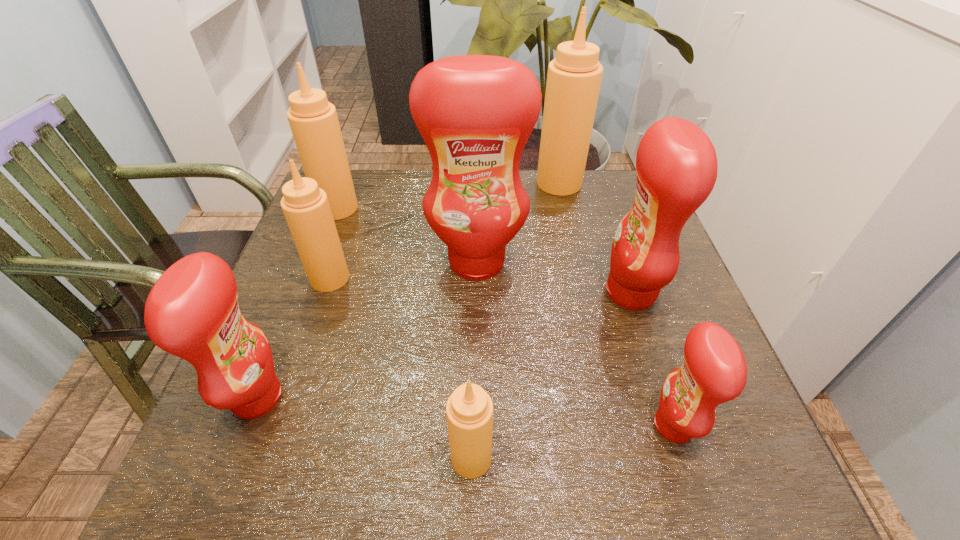
At what (x,y) coordinates should I click in order to perform the action: click on object that stands as the sixth closest to the second smallest red condiment. Please return your answer as a coordinate pair (x, y). The width and height of the screenshot is (960, 540). Looking at the image, I should click on (714, 371).

At what (x,y) coordinates should I click in order to perform the action: click on the fourth closest object to the third tan condiment from left to right. Please return your answer as a coordinate pair (x, y). This screenshot has height=540, width=960. Looking at the image, I should click on (475, 113).

Point out which condiment is positioned as the nearest to the smallest tan condiment. Please provide its 2D coordinates. Your answer should be formatted as a tuple, i.e. [(x, y)], where the tuple contains the x and y coordinates of a point satisfying the conditions above.

[(714, 371)]

I want to click on condiment that can be found as the fourth closest to the third biggest tan condiment, so click(469, 410).

Where is `the fourth closest tan condiment relative to the third smallest red condiment`? the fourth closest tan condiment relative to the third smallest red condiment is located at coordinates (313, 120).

Image resolution: width=960 pixels, height=540 pixels. What are the coordinates of `the third closest tan condiment relative to the third red condiment from right to left` in the screenshot? It's located at pyautogui.click(x=313, y=120).

What are the coordinates of `red condiment that is the third closest to the smallest red condiment` in the screenshot? It's located at (192, 312).

Point out which red condiment is positioned as the nearest to the third farthest tan condiment. Please provide its 2D coordinates. Your answer should be formatted as a tuple, i.e. [(x, y)], where the tuple contains the x and y coordinates of a point satisfying the conditions above.

[(475, 113)]

The width and height of the screenshot is (960, 540). What are the coordinates of `blank area in the image that satisfies the following two spatial constraints: 1. on the label side of the smallest tan condiment; 2. on the left side of the third biggest red condiment` in the screenshot? It's located at (232, 458).